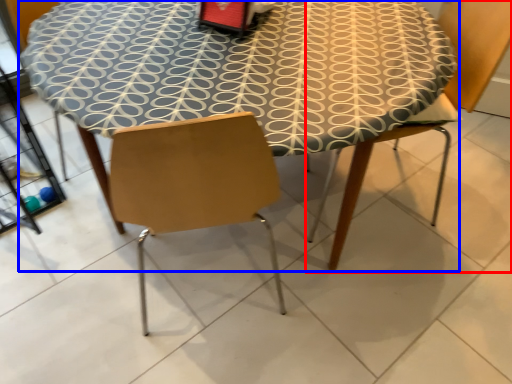
Question: Which object appears farthest to the camera in this image, chair (highlighted by a red box) or table (highlighted by a blue box)?

Choices:
 (A) chair
 (B) table

Answer: (A)